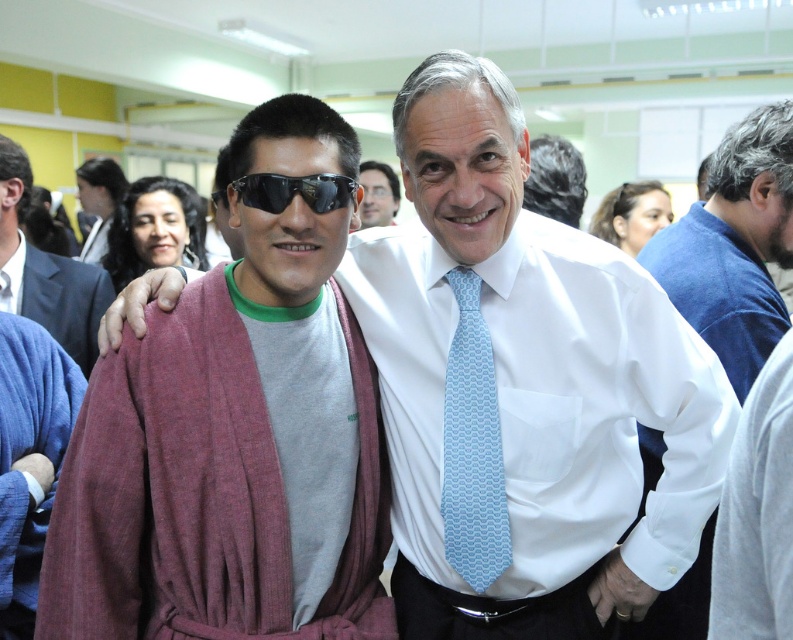
You are standing at the entrance of the room and see two points marked in the image. The first point is at coordinate point(23, 605) and the second at point(380, 193). Which point is closer to you?

Point(23, 605) is in front of point(380, 193), so it is closer to you.

You are a photographer at the event and need to ensure both the maroon woolen robe at center and the white shirt at center are visible in the photo. Based on their positions, which one is positioned lower in the frame?

The maroon woolen robe at center is located below the white shirt at center, so it is positioned lower in the frame.

You are standing at a distance of 6 feet from the image. Is the point at coordinates point (25, 493) closer to you than the rest of the image?

The point at coordinates point (25, 493) is 5.45 feet away from the viewer. Since you are standing 6 feet away from the image, the point is slightly closer than your current position.